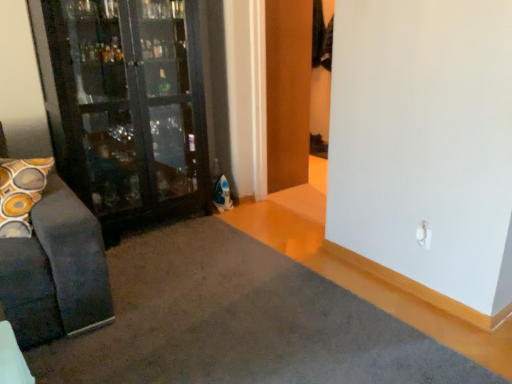
Question: From a real-world perspective, is wooden door at center on gray carpet at lower left?

Choices:
 (A) no
 (B) yes

Answer: (B)

Question: Is gray carpet at lower left a part of wooden door at center?

Choices:
 (A) yes
 (B) no

Answer: (B)

Question: Considering the relative sizes of wooden door at center and gray carpet at lower left in the image provided, is wooden door at center taller than gray carpet at lower left?

Choices:
 (A) yes
 (B) no

Answer: (A)

Question: From the image's perspective, is wooden door at center on top of gray carpet at lower left?

Choices:
 (A) no
 (B) yes

Answer: (B)

Question: Is wooden door at center to the right of gray carpet at lower left from the viewer's perspective?

Choices:
 (A) no
 (B) yes

Answer: (B)

Question: Could you tell me if wooden door at center is facing gray carpet at lower left?

Choices:
 (A) yes
 (B) no

Answer: (B)

Question: Considering the relative sizes of gray carpet at lower left and wooden door at center in the image provided, is gray carpet at lower left bigger than wooden door at center?

Choices:
 (A) yes
 (B) no

Answer: (B)

Question: Is gray carpet at lower left behind wooden door at center?

Choices:
 (A) no
 (B) yes

Answer: (A)

Question: Is gray carpet at lower left facing towards wooden door at center?

Choices:
 (A) yes
 (B) no

Answer: (B)

Question: Can you confirm if gray carpet at lower left is taller than wooden door at center?

Choices:
 (A) no
 (B) yes

Answer: (A)

Question: Are gray carpet at lower left and wooden door at center far apart?

Choices:
 (A) yes
 (B) no

Answer: (A)

Question: Is gray carpet at lower left positioned before wooden door at center?

Choices:
 (A) yes
 (B) no

Answer: (A)

Question: Looking at the image, does wooden door at center seem bigger or smaller compared to gray carpet at lower left?

Choices:
 (A) big
 (B) small

Answer: (A)